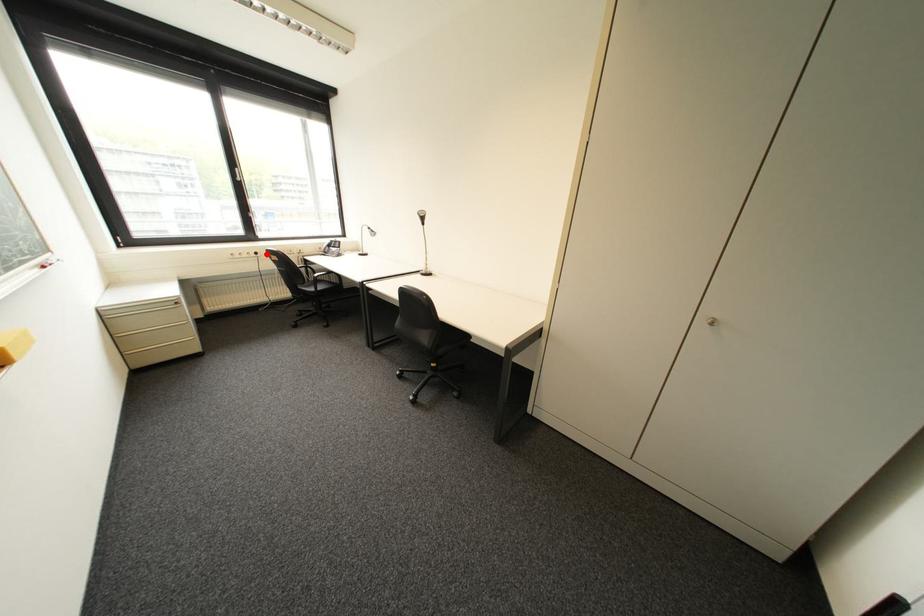
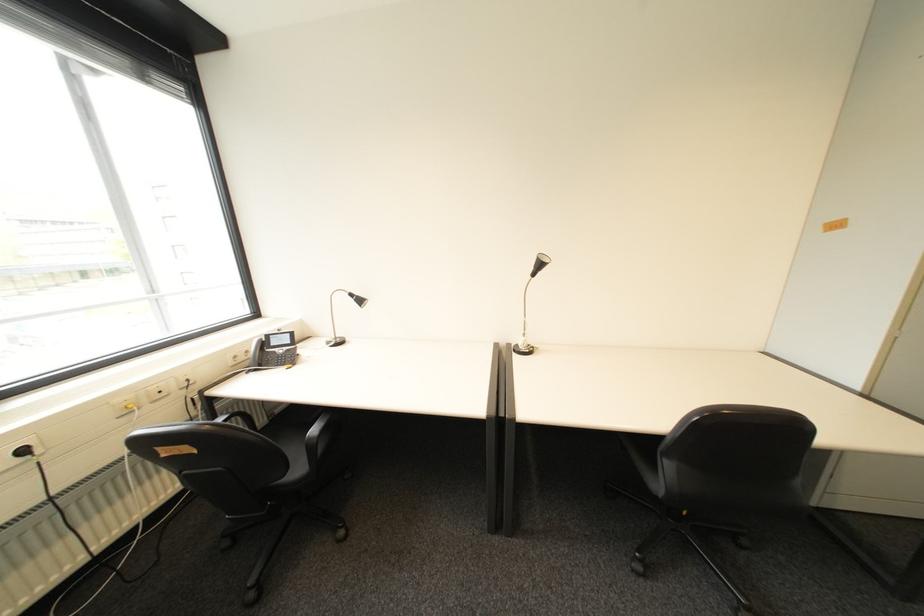
Question: I am providing you with two images of the same scene from different viewpoints. Given a red point in image1, look at the same physical point in image2. Is it:

Choices:
 (A) Closer to the viewpoint
 (B) Farther from the viewpoint

Answer: (B)